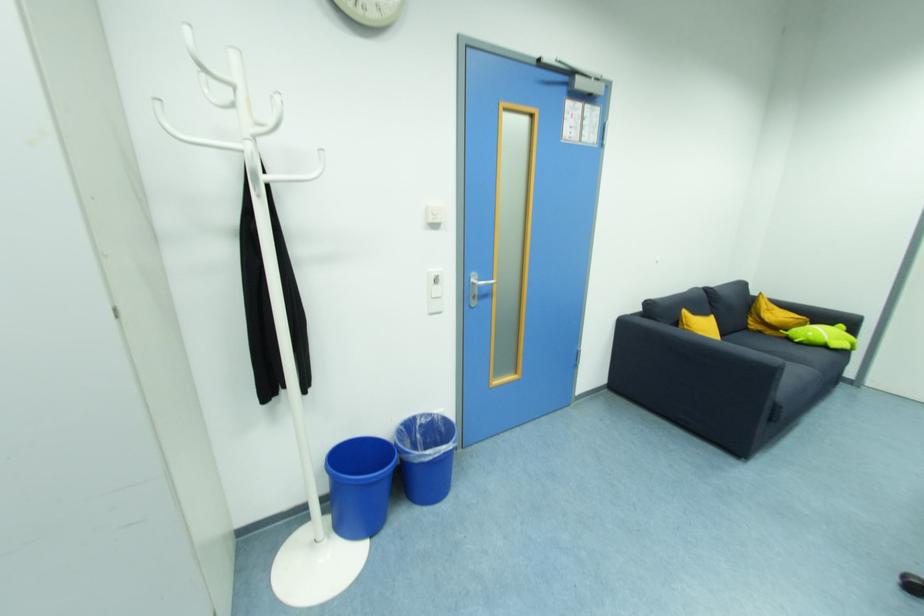
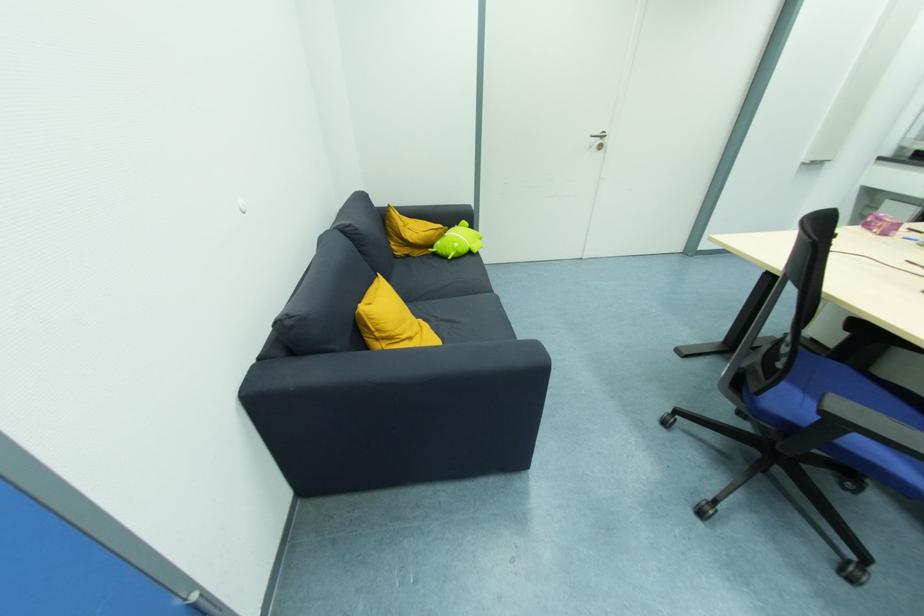
In the second image, find the point that corresponds to [788,331] in the first image.

(435, 248)